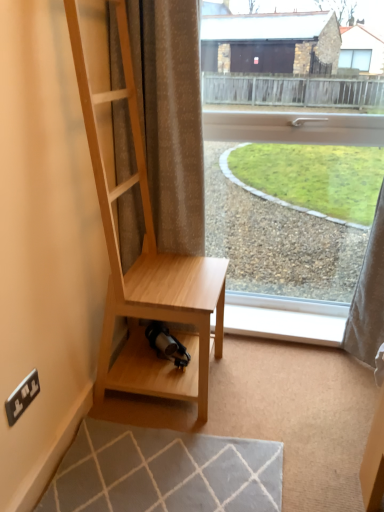
The width and height of the screenshot is (384, 512). I want to click on free space to the right of light wood shelf at center, so click(256, 387).